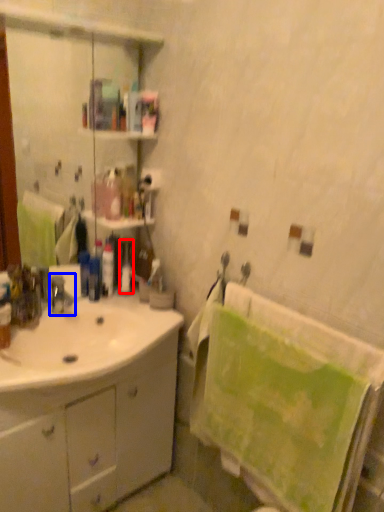
Question: Which object is closer to the camera taking this photo, toiletry (highlighted by a red box) or tap (highlighted by a blue box)?

Choices:
 (A) toiletry
 (B) tap

Answer: (B)